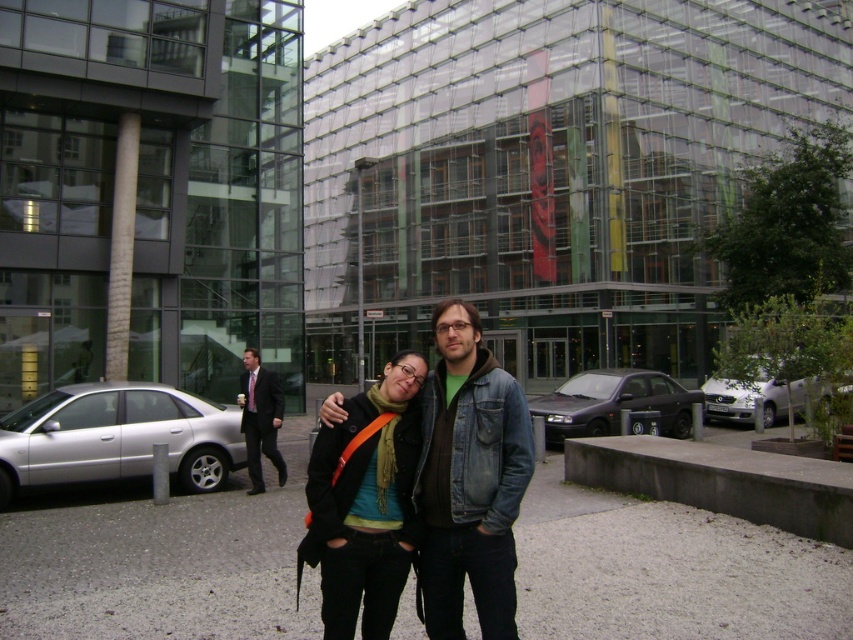
Between point (511, 593) and point (805, 381), which one is positioned in front?

Point (511, 593)

Between denim jacket at center and white metallic car at right, which one is positioned lower?

white metallic car at right is below.

Between point (502, 504) and point (773, 400), which one is positioned in front?

Point (502, 504) is in front.

Where is `denim jacket at center`? The height and width of the screenshot is (640, 853). denim jacket at center is located at coordinates (469, 477).

Is point (376, 516) positioned after point (705, 406)?

That is False.

Can you confirm if matte black jacket at center is positioned above white metallic car at right?

Correct, matte black jacket at center is located above white metallic car at right.

Between point (409, 365) and point (775, 380), which one is positioned in front?

Point (409, 365) is more forward.

You are a GUI agent. You are given a task and a screenshot of the screen. Output one action in this format:
    pyautogui.click(x=<x>, y=<y>)
    Task: Click on the matte black jacket at center
    Image resolution: width=853 pixels, height=640 pixels.
    Given the screenshot: What is the action you would take?
    pyautogui.click(x=364, y=502)

Is silver metallic car at left thinner than white metallic car at right?

Correct, silver metallic car at left's width is less than white metallic car at right's.

The width and height of the screenshot is (853, 640). In order to click on silver metallic car at left in this screenshot , I will do click(117, 436).